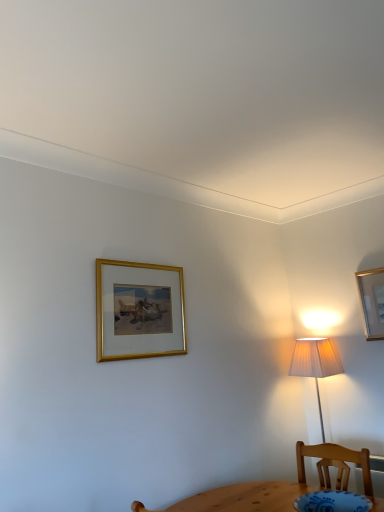
Where is `gold-framed painting at upper center, positioned as the second picture frame in back-to-front order`? This screenshot has width=384, height=512. gold-framed painting at upper center, positioned as the second picture frame in back-to-front order is located at coordinates (139, 310).

What do you see at coordinates (139, 310) in the screenshot? I see `gold-framed painting at upper center, which is the 1th picture frame in left-to-right order` at bounding box center [139, 310].

Where is `metallic gold picture frame at upper right, positioned as the 2th picture frame in left-to-right order`? metallic gold picture frame at upper right, positioned as the 2th picture frame in left-to-right order is located at coordinates click(372, 301).

Image resolution: width=384 pixels, height=512 pixels. Describe the element at coordinates (372, 301) in the screenshot. I see `metallic gold picture frame at upper right, which is counted as the 1th picture frame, starting from the right` at that location.

Image resolution: width=384 pixels, height=512 pixels. Find the location of `gold-framed painting at upper center, positioned as the first picture frame in front-to-back order`. gold-framed painting at upper center, positioned as the first picture frame in front-to-back order is located at coordinates (139, 310).

In the scene shown: Considering the relative positions of gold-framed painting at upper center, positioned as the second picture frame in back-to-front order, and metallic gold picture frame at upper right, which appears as the 2th picture frame when viewed from the front, in the image provided, is gold-framed painting at upper center, positioned as the second picture frame in back-to-front order, to the right of metallic gold picture frame at upper right, which appears as the 2th picture frame when viewed from the front, from the viewer's perspective?

No, gold-framed painting at upper center, positioned as the second picture frame in back-to-front order, is not to the right of metallic gold picture frame at upper right, which appears as the 2th picture frame when viewed from the front.

Is gold-framed painting at upper center, which is counted as the 2th picture frame, starting from the right, in front of or behind metallic gold picture frame at upper right, which appears as the 1th picture frame when viewed from the back, in the image?

Clearly, gold-framed painting at upper center, which is counted as the 2th picture frame, starting from the right, is in front of metallic gold picture frame at upper right, which appears as the 1th picture frame when viewed from the back.

Considering the points (175, 298) and (361, 281), which point is in front, point (175, 298) or point (361, 281)?

The point (175, 298) is closer.

From the image's perspective, which one is positioned higher, gold-framed painting at upper center, which is counted as the 2th picture frame, starting from the right, or metallic gold picture frame at upper right, positioned as the 2th picture frame in left-to-right order?

gold-framed painting at upper center, which is counted as the 2th picture frame, starting from the right, from the image's perspective.

From a real-world perspective, which is physically above, gold-framed painting at upper center, positioned as the first picture frame in front-to-back order, or metallic gold picture frame at upper right, positioned as the 2th picture frame in left-to-right order?

In real-world perspective, gold-framed painting at upper center, positioned as the first picture frame in front-to-back order, is above.

Looking at this image, is gold-framed painting at upper center, positioned as the second picture frame in back-to-front order, thinner than metallic gold picture frame at upper right, which appears as the 2th picture frame when viewed from the front?

No.

In terms of height, does gold-framed painting at upper center, which is counted as the 2th picture frame, starting from the right, look taller or shorter compared to metallic gold picture frame at upper right, positioned as the 2th picture frame in left-to-right order?

In the image, gold-framed painting at upper center, which is counted as the 2th picture frame, starting from the right, appears to be taller than metallic gold picture frame at upper right, positioned as the 2th picture frame in left-to-right order.

Considering the sizes of objects gold-framed painting at upper center, positioned as the second picture frame in back-to-front order, and metallic gold picture frame at upper right, which is counted as the 1th picture frame, starting from the right, in the image provided, who is bigger, gold-framed painting at upper center, positioned as the second picture frame in back-to-front order, or metallic gold picture frame at upper right, which is counted as the 1th picture frame, starting from the right,?

Bigger between the two is gold-framed painting at upper center, positioned as the second picture frame in back-to-front order.

Is gold-framed painting at upper center, which is the 1th picture frame in left-to-right order, completely or partially outside of metallic gold picture frame at upper right, positioned as the 2th picture frame in left-to-right order?

Indeed, gold-framed painting at upper center, which is the 1th picture frame in left-to-right order, is completely outside metallic gold picture frame at upper right, positioned as the 2th picture frame in left-to-right order.

Are gold-framed painting at upper center, which is the 1th picture frame in left-to-right order, and metallic gold picture frame at upper right, positioned as the 2th picture frame in left-to-right order, located far from each other?

Yes, gold-framed painting at upper center, which is the 1th picture frame in left-to-right order, and metallic gold picture frame at upper right, positioned as the 2th picture frame in left-to-right order, are located far from each other.

Could you tell me if gold-framed painting at upper center, which is counted as the 2th picture frame, starting from the right, is facing metallic gold picture frame at upper right, which appears as the 1th picture frame when viewed from the back?

No.

At what (x,y) coordinates should I click in order to perform the action: click on picture frame above the metallic gold picture frame at upper right, which appears as the 2th picture frame when viewed from the front (from the image's perspective). Please return your answer as a coordinate pair (x, y). This screenshot has height=512, width=384. Looking at the image, I should click on (139, 310).

Between metallic gold picture frame at upper right, which appears as the 1th picture frame when viewed from the back, and gold-framed painting at upper center, which is counted as the 2th picture frame, starting from the right, which one appears on the right side from the viewer's perspective?

Positioned to the right is metallic gold picture frame at upper right, which appears as the 1th picture frame when viewed from the back.

In the scene shown: Is the depth of metallic gold picture frame at upper right, positioned as the 2th picture frame in left-to-right order, less than that of gold-framed painting at upper center, positioned as the second picture frame in back-to-front order?

No, it is behind gold-framed painting at upper center, positioned as the second picture frame in back-to-front order.

Is point (372, 321) less distant than point (154, 328)?

No.

From the image's perspective, is metallic gold picture frame at upper right, which appears as the 1th picture frame when viewed from the back, above or below gold-framed painting at upper center, positioned as the first picture frame in front-to-back order?

metallic gold picture frame at upper right, which appears as the 1th picture frame when viewed from the back, is below gold-framed painting at upper center, positioned as the first picture frame in front-to-back order.

From a real-world perspective, is metallic gold picture frame at upper right, which appears as the 1th picture frame when viewed from the back, below gold-framed painting at upper center, positioned as the second picture frame in back-to-front order?

Indeed, from a real-world perspective, metallic gold picture frame at upper right, which appears as the 1th picture frame when viewed from the back, is positioned beneath gold-framed painting at upper center, positioned as the second picture frame in back-to-front order.

Which of these two, metallic gold picture frame at upper right, which appears as the 1th picture frame when viewed from the back, or gold-framed painting at upper center, which is the 1th picture frame in left-to-right order, is wider?

With larger width is gold-framed painting at upper center, which is the 1th picture frame in left-to-right order.

Looking at this image, considering the relative sizes of metallic gold picture frame at upper right, which appears as the 2th picture frame when viewed from the front, and gold-framed painting at upper center, positioned as the first picture frame in front-to-back order, in the image provided, is metallic gold picture frame at upper right, which appears as the 2th picture frame when viewed from the front, shorter than gold-framed painting at upper center, positioned as the first picture frame in front-to-back order,?

Yes, metallic gold picture frame at upper right, which appears as the 2th picture frame when viewed from the front, is shorter than gold-framed painting at upper center, positioned as the first picture frame in front-to-back order.

In terms of size, does metallic gold picture frame at upper right, which is counted as the 1th picture frame, starting from the right, appear bigger or smaller than gold-framed painting at upper center, which is counted as the 2th picture frame, starting from the right?

Clearly, metallic gold picture frame at upper right, which is counted as the 1th picture frame, starting from the right, is smaller in size than gold-framed painting at upper center, which is counted as the 2th picture frame, starting from the right.

From the picture: Would you say metallic gold picture frame at upper right, which appears as the 1th picture frame when viewed from the back, is outside gold-framed painting at upper center, which is the 1th picture frame in left-to-right order?

metallic gold picture frame at upper right, which appears as the 1th picture frame when viewed from the back, is positioned outside gold-framed painting at upper center, which is the 1th picture frame in left-to-right order.

Is metallic gold picture frame at upper right, positioned as the 2th picture frame in left-to-right order, with gold-framed painting at upper center, which is the 1th picture frame in left-to-right order?

metallic gold picture frame at upper right, positioned as the 2th picture frame in left-to-right order, and gold-framed painting at upper center, which is the 1th picture frame in left-to-right order, are not in contact.

Is metallic gold picture frame at upper right, which appears as the 1th picture frame when viewed from the back, aimed at gold-framed painting at upper center, which is counted as the 2th picture frame, starting from the right?

No, metallic gold picture frame at upper right, which appears as the 1th picture frame when viewed from the back, is not facing towards gold-framed painting at upper center, which is counted as the 2th picture frame, starting from the right.

What's the angular difference between metallic gold picture frame at upper right, which appears as the 1th picture frame when viewed from the back, and gold-framed painting at upper center, which is the 1th picture frame in left-to-right order,'s facing directions?

90.4 degrees.

Could you measure the distance between metallic gold picture frame at upper right, which appears as the 1th picture frame when viewed from the back, and gold-framed painting at upper center, positioned as the first picture frame in front-to-back order?

metallic gold picture frame at upper right, which appears as the 1th picture frame when viewed from the back, is 4.54 feet from gold-framed painting at upper center, positioned as the first picture frame in front-to-back order.

Image resolution: width=384 pixels, height=512 pixels. Identify the location of picture frame behind the gold-framed painting at upper center, which is the 1th picture frame in left-to-right order. (372, 301).

Locate an element on the screen. The image size is (384, 512). picture frame below the gold-framed painting at upper center, positioned as the second picture frame in back-to-front order (from the image's perspective) is located at coordinates (372, 301).

Where is `picture frame above the metallic gold picture frame at upper right, positioned as the 2th picture frame in left-to-right order (from the image's perspective)`? picture frame above the metallic gold picture frame at upper right, positioned as the 2th picture frame in left-to-right order (from the image's perspective) is located at coordinates (139, 310).